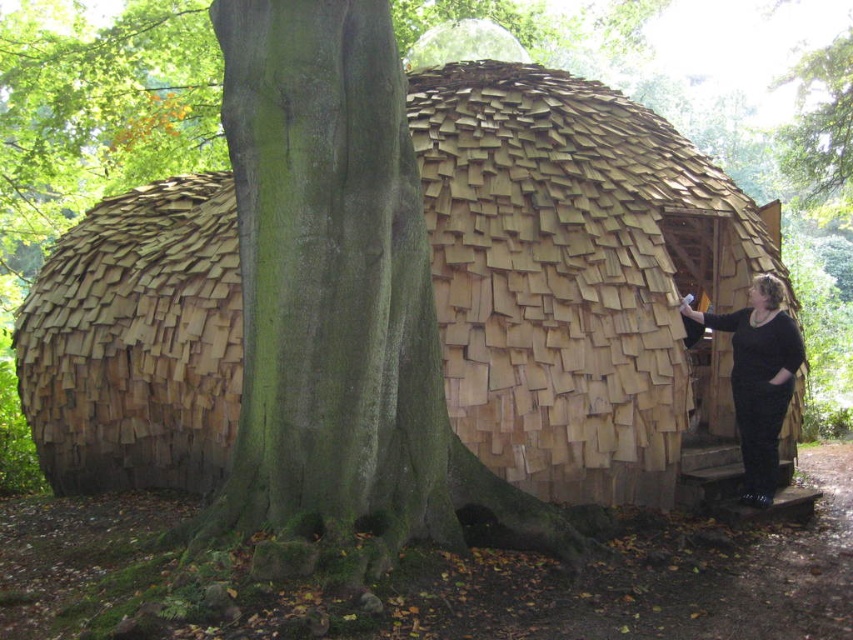
Who is taller, green rough bark tree trunk at center or green bark tree at upper center?

green rough bark tree trunk at center is taller.

Based on the photo, does green rough bark tree trunk at center appear on the left side of green bark tree at upper center?

Yes, green rough bark tree trunk at center is to the left of green bark tree at upper center.

Is point (397, 490) positioned before point (795, 67)?

Yes, it is.

The image size is (853, 640). Identify the location of green rough bark tree trunk at center. (329, 291).

Is black matte clothing at right further to camera compared to green bark tree at upper center?

No.

Who is more distant from viewer, (764,490) or (820,65)?

The point (820,65) is behind.

The width and height of the screenshot is (853, 640). Describe the element at coordinates (758, 378) in the screenshot. I see `black matte clothing at right` at that location.

This screenshot has width=853, height=640. In order to click on black matte clothing at right in this screenshot , I will do `click(758, 378)`.

Can you confirm if green rough bark tree trunk at center is taller than black matte clothing at right?

Yes, green rough bark tree trunk at center is taller than black matte clothing at right.

Can you confirm if green rough bark tree trunk at center is thinner than black matte clothing at right?

In fact, green rough bark tree trunk at center might be wider than black matte clothing at right.

Who is more forward, (299, 410) or (790, 364)?

Point (299, 410) is more forward.

The image size is (853, 640). Identify the location of green rough bark tree trunk at center. (329, 291).